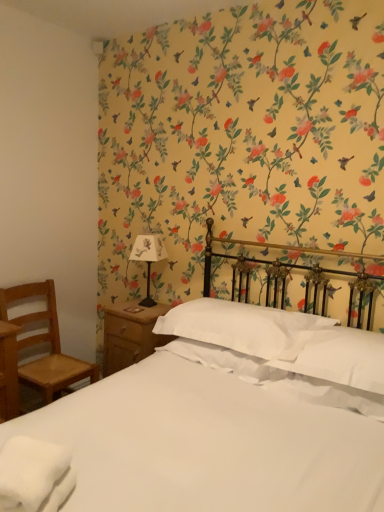
Question: From their relative heights in the image, would you say white soft pillow at center, the 1th pillow when ordered from left to right, is taller or shorter than white soft towel at lower left?

Choices:
 (A) short
 (B) tall

Answer: (B)

Question: From a real-world perspective, is white soft pillow at center, the 2th pillow positioned from the right, positioned above or below white soft towel at lower left?

Choices:
 (A) above
 (B) below

Answer: (A)

Question: Which of these objects is positioned closest to the white soft pillow at center, the 2th pillow positioned from the right?

Choices:
 (A) wooden nightstand at lower left
 (B) white satin bed at center
 (C) white soft towel at lower left
 (D) white paper lampshade at upper left
 (E) white soft pillow at center, which ranks as the 2th pillow in left-to-right order

Answer: (E)

Question: Which is farther from the white paper lampshade at upper left?

Choices:
 (A) white soft towel at lower left
 (B) white soft pillow at center, the 2th pillow positioned from the right
 (C) white satin bed at center
 (D) wooden nightstand at lower left
 (E) white soft pillow at center, which ranks as the 2th pillow in left-to-right order

Answer: (A)